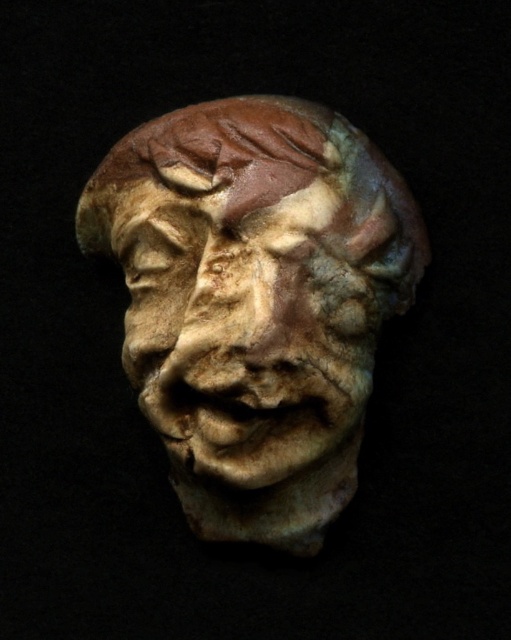
Question: Is matte clay sculpture at center below matte clay face at center?

Choices:
 (A) no
 (B) yes

Answer: (A)

Question: Among these points, which one is nearest to the camera?

Choices:
 (A) (337, 336)
 (B) (277, 464)

Answer: (B)

Question: Does matte clay sculpture at center come in front of matte clay face at center?

Choices:
 (A) yes
 (B) no

Answer: (B)

Question: Does matte clay sculpture at center come in front of matte clay face at center?

Choices:
 (A) no
 (B) yes

Answer: (A)

Question: Among these points, which one is farthest from the camera?

Choices:
 (A) (207, 292)
 (B) (271, 225)

Answer: (B)

Question: Which object is farther from the camera taking this photo?

Choices:
 (A) matte clay sculpture at center
 (B) matte clay face at center

Answer: (A)